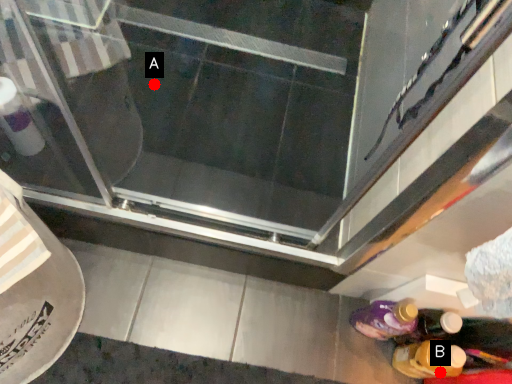
Question: Two points are circled on the image, labeled by A and B beside each circle. Which point appears farthest from the camera in this image?

Choices:
 (A) A is further
 (B) B is further

Answer: (A)